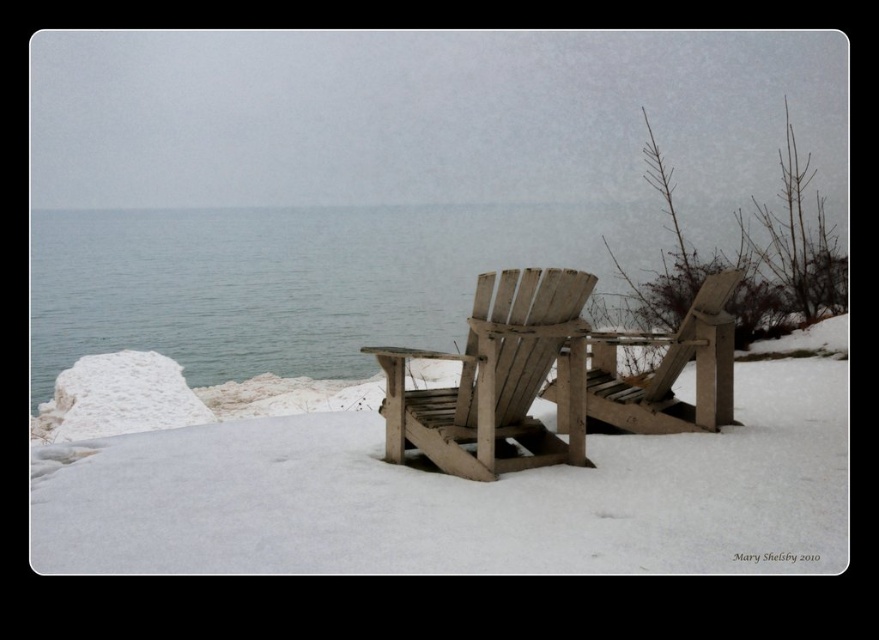
The height and width of the screenshot is (640, 879). Find the location of `white matte snow at center`. white matte snow at center is located at coordinates (462, 497).

Is white matte snow at center above clear water at center?

No.

The height and width of the screenshot is (640, 879). In order to click on white matte snow at center in this screenshot , I will do `click(462, 497)`.

Locate an element on the screen. The width and height of the screenshot is (879, 640). white matte snow at center is located at coordinates (462, 497).

Is white matte snow at center shorter than wooden beach chair at center?

Indeed, white matte snow at center has a lesser height compared to wooden beach chair at center.

Between white matte snow at center and wooden beach chair at center, which one appears on the right side from the viewer's perspective?

Positioned to the right is wooden beach chair at center.

From the picture: Who is more distant from viewer, [583,477] or [662,404]?

Positioned behind is point [662,404].

Find the location of a particular element. The image size is (879, 640). white matte snow at center is located at coordinates (462, 497).

Is point (398, 452) farther from camera compared to point (631, 432)?

That is False.

Does point (383, 349) come in front of point (596, 364)?

That is True.

Find the location of a particular element. The image size is (879, 640). weathered wood beach chair at center is located at coordinates (496, 380).